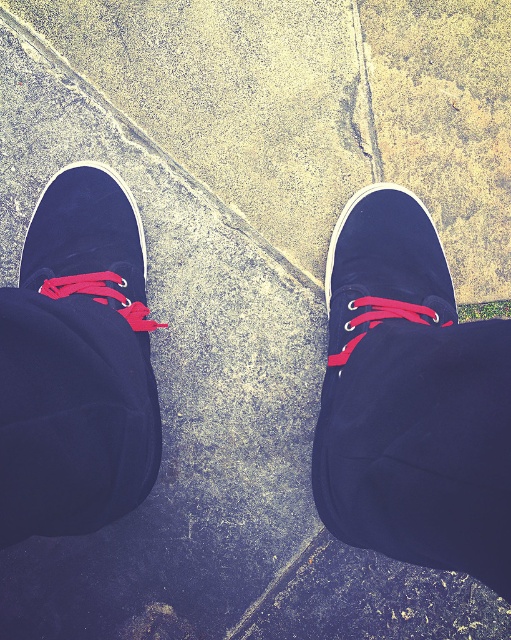
Based on the photo, who is more distant from viewer, (473, 561) or (107, 374)?

Positioned behind is point (107, 374).

Is suede-like navy blue shoe at center bigger than suede blue shoe at left?

Correct, suede-like navy blue shoe at center is larger in size than suede blue shoe at left.

Image resolution: width=511 pixels, height=640 pixels. I want to click on suede-like navy blue shoe at center, so click(410, 400).